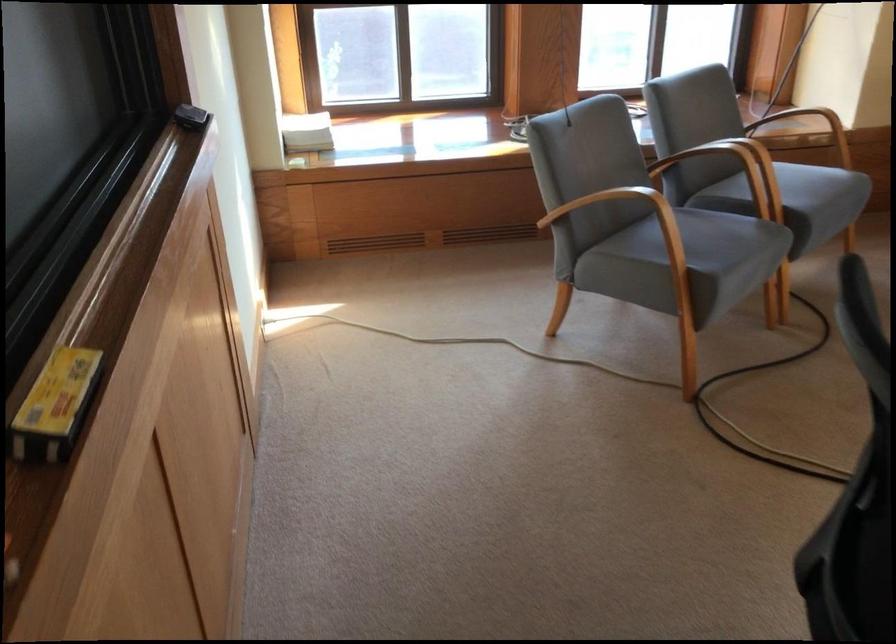
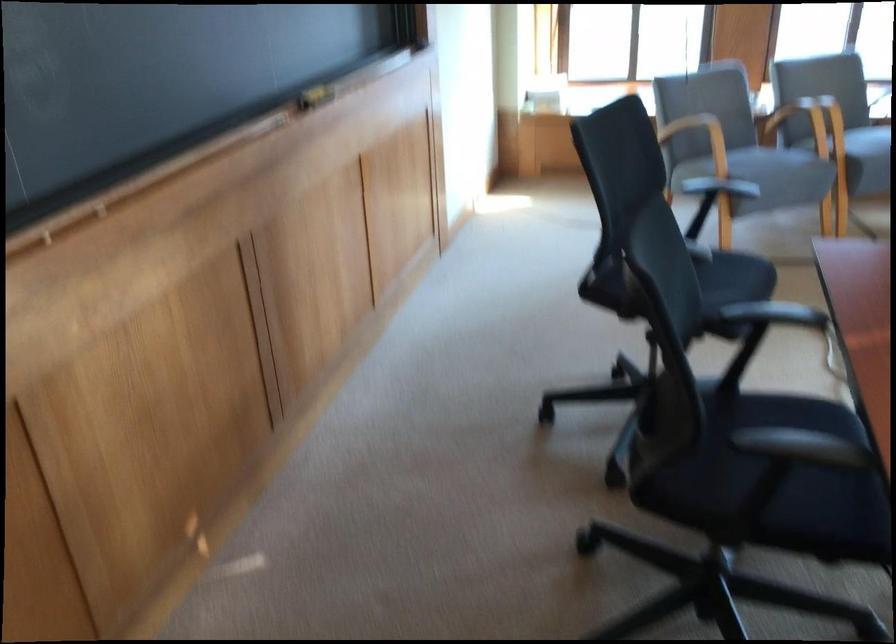
Which direction would the cameraman need to move to produce the second image?

The movement direction of the cameraman is right, backward.